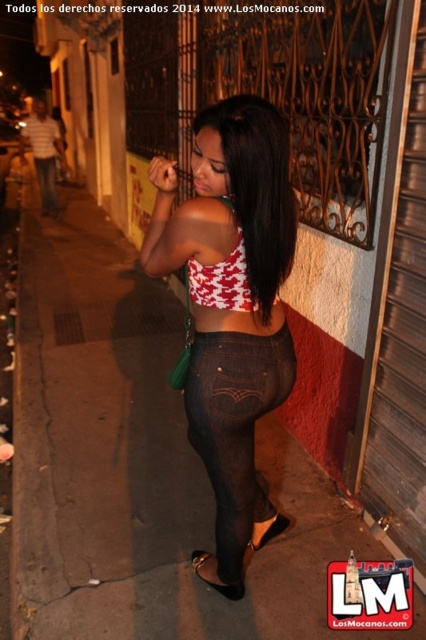
Does white printed fabric bikini top at center have a greater width compared to white striped shirt at upper left?

Incorrect, white printed fabric bikini top at center's width does not surpass white striped shirt at upper left's.

Who is more forward, (196, 296) or (54, 138)?

Positioned in front is point (196, 296).

Is point (242, 296) less distant than point (49, 195)?

Yes.

The width and height of the screenshot is (426, 640). Find the location of `white printed fabric bikini top at center`. white printed fabric bikini top at center is located at coordinates (221, 282).

Is black mesh leggings at center thinner than black patent leather sandal at lower center?

No.

Does black mesh leggings at center have a lesser height compared to black patent leather sandal at lower center?

Incorrect, black mesh leggings at center's height does not fall short of black patent leather sandal at lower center's.

You are a GUI agent. You are given a task and a screenshot of the screen. Output one action in this format:
    pyautogui.click(x=<x>, y=<y>)
    Task: Click on the black mesh leggings at center
    This screenshot has height=640, width=426.
    Given the screenshot: What is the action you would take?
    pyautogui.click(x=235, y=426)

Does black mesh leggings at center appear under black leather sandal at lower center?

No.

Who is higher up, black mesh leggings at center or black leather sandal at lower center?

black mesh leggings at center

What are the coordinates of `black mesh leggings at center` in the screenshot? It's located at (235, 426).